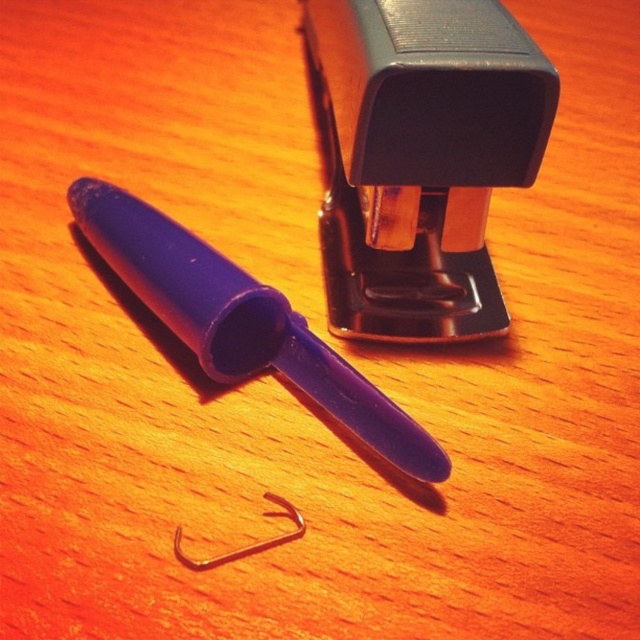
You are organizing office supplies and need to place the black plastic stapler at upper center and the silver metallic hook at center into a drawer. The drawer has a height limit of 10 cm. Can both items fit vertically without bending or damaging them?

The black plastic stapler at upper center is larger than the silver metallic hook at center. Since the drawer has a height limit of 10 cm, it is possible that the larger stapler may exceed this height, making it unable to fit vertically without bending or damaging it. The hook might fit, but the stapler might not.

You are standing at the purple plastic pen at center and want to take a photo of the camera. Can you reach the camera without moving from your current position?

The purple plastic pen at center and camera are 3.82 feet apart, so you can reach the camera without moving from your current position if your arm or device can extend that far. However, the description does not specify your reach capability, so it depends on your ability to reach 3.82 feet.

You are standing in an office and see the black plastic stapler at upper center on a desk. If you want to reach it without moving your chair, can you estimate how far it is from your eyes?

The black plastic stapler at upper center is 3.50 feet away from the viewer, so you can estimate it is about 3.5 feet away from your eyes.